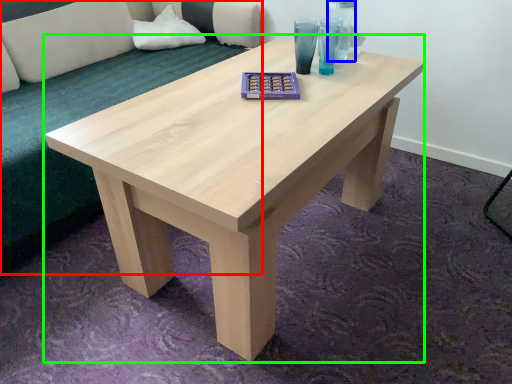
Question: Based on their relative distances, which object is farther from couch (highlighted by a red box)? Choose from glass vase (highlighted by a blue box) and coffee table (highlighted by a green box).

Choices:
 (A) glass vase
 (B) coffee table

Answer: (A)